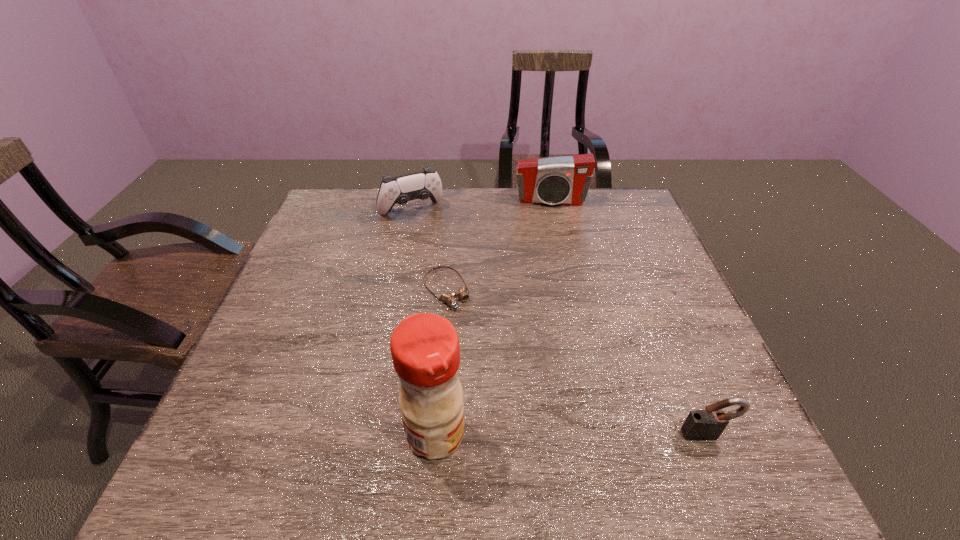
The width and height of the screenshot is (960, 540). I want to click on empty space between the fourth object from left to right and the padlock, so click(x=629, y=318).

The height and width of the screenshot is (540, 960). I want to click on vacant point located between the padlock and the tallest object, so click(x=571, y=434).

Where is `vacant point located between the shortest object and the padlock`? This screenshot has height=540, width=960. vacant point located between the shortest object and the padlock is located at coordinates pos(576,362).

You are a GUI agent. You are given a task and a screenshot of the screen. Output one action in this format:
    pyautogui.click(x=<x>, y=<y>)
    Task: Click on the free point between the camera and the control
    This screenshot has height=540, width=960.
    Given the screenshot: What is the action you would take?
    pyautogui.click(x=481, y=206)

Locate an element on the screen. vacant space that is in between the control and the fourth tallest object is located at coordinates (559, 322).

Locate which object is the fourth closest to the third farthest object. Please provide its 2D coordinates. Your answer should be formatted as a tuple, i.e. [(x, y)], where the tuple contains the x and y coordinates of a point satisfying the conditions above.

[(700, 425)]

Select which object is the second closest to the control. Please provide its 2D coordinates. Your answer should be formatted as a tuple, i.e. [(x, y)], where the tuple contains the x and y coordinates of a point satisfying the conditions above.

[(563, 180)]

Find the location of a particular element. This screenshot has width=960, height=540. free space that satisfies the following two spatial constraints: 1. on the back side of the tallest object; 2. on the left side of the camera is located at coordinates (454, 201).

You are a GUI agent. You are given a task and a screenshot of the screen. Output one action in this format:
    pyautogui.click(x=<x>, y=<y>)
    Task: Click on the vacant area in the image that satisfies the following two spatial constraints: 1. on the front side of the control; 2. on the left side of the shortest object
    The image size is (960, 540).
    Given the screenshot: What is the action you would take?
    [x=395, y=290]